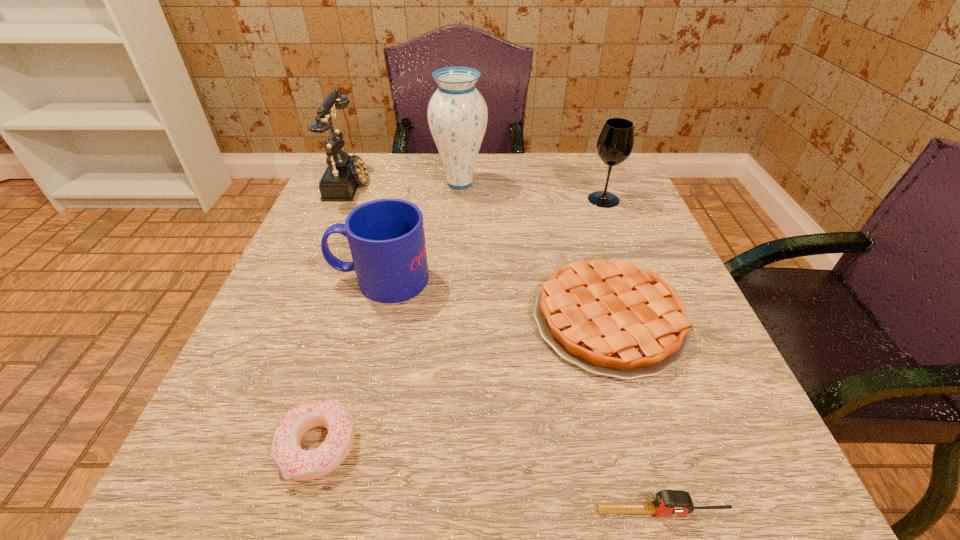
Locate an element on the screen. The height and width of the screenshot is (540, 960). vacant region between the doughnut and the telephone is located at coordinates tap(334, 314).

Identify the location of free point between the telephone and the nearest object. Image resolution: width=960 pixels, height=540 pixels. (507, 347).

This screenshot has height=540, width=960. In order to click on free spot between the second nearest object and the wineglass in this screenshot , I will do coord(461,323).

Find the location of a particular element. free spot between the mug and the wineglass is located at coordinates (492, 239).

This screenshot has height=540, width=960. In order to click on vacant area that lies between the pie and the sixth farthest object in this screenshot , I will do `click(463, 383)`.

Where is `the closest object relative to the wineglass`? The height and width of the screenshot is (540, 960). the closest object relative to the wineglass is located at coordinates (609, 318).

Locate which object ranks third in proximity to the wineglass. Please provide its 2D coordinates. Your answer should be formatted as a tuple, i.e. [(x, y)], where the tuple contains the x and y coordinates of a point satisfying the conditions above.

[(386, 237)]

The image size is (960, 540). Identify the location of free space that satisfies the following two spatial constraints: 1. on the dial of the tape measure; 2. on the right side of the telephone. (208, 511).

Locate an element on the screen. vacant region that satisfies the following two spatial constraints: 1. on the front side of the tallest object; 2. on the right side of the tape measure is located at coordinates (439, 511).

Image resolution: width=960 pixels, height=540 pixels. What are the coordinates of `vacant region that satisfies the following two spatial constraints: 1. on the dial of the telephone; 2. on the back side of the second nearest object` in the screenshot? It's located at (236, 447).